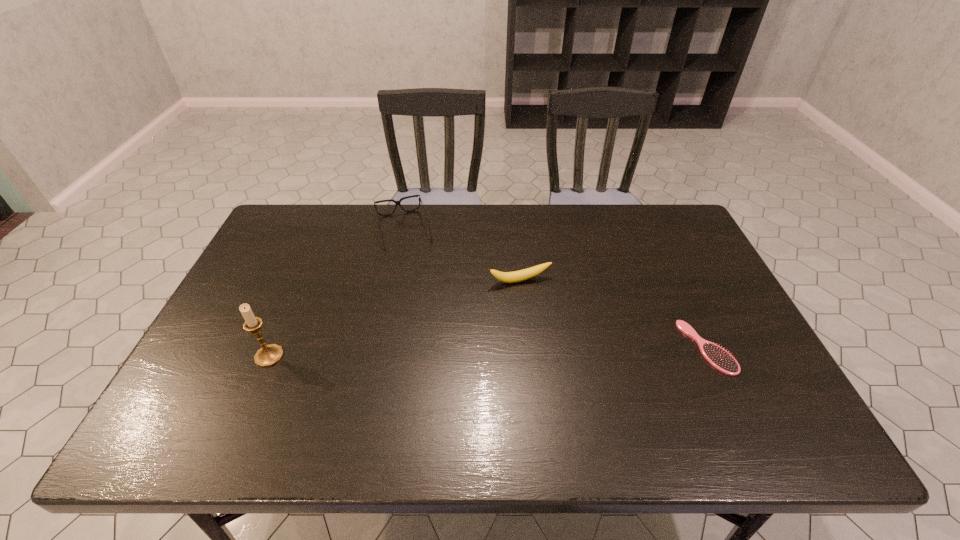
This screenshot has height=540, width=960. In order to click on vacant space that is in between the second object from right to left and the leftmost object in this screenshot , I will do `click(395, 318)`.

Locate an element on the screen. This screenshot has height=540, width=960. empty space that is in between the third object from left to right and the third object from right to left is located at coordinates (462, 255).

Locate an element on the screen. The width and height of the screenshot is (960, 540). free space between the rightmost object and the second farthest object is located at coordinates (613, 314).

You are a GUI agent. You are given a task and a screenshot of the screen. Output one action in this format:
    pyautogui.click(x=<x>, y=<y>)
    Task: Click on the free area in between the hairbrush and the farthest object
    The image size is (960, 540).
    Given the screenshot: What is the action you would take?
    pyautogui.click(x=555, y=288)

What are the coordinates of `vacant area that lies between the leftmost object and the banana` in the screenshot? It's located at (395, 318).

The width and height of the screenshot is (960, 540). Find the location of `free space between the third object from left to right and the rightmost object`. free space between the third object from left to right and the rightmost object is located at coordinates (613, 314).

Locate an element on the screen. This screenshot has width=960, height=540. empty location between the third object from right to left and the second farthest object is located at coordinates (462, 255).

Find the location of a particular element. the closest object relative to the second object from right to left is located at coordinates (396, 202).

Point out which object is positioned as the third nearest to the farthest object. Please provide its 2D coordinates. Your answer should be formatted as a tuple, i.e. [(x, y)], where the tuple contains the x and y coordinates of a point satisfying the conditions above.

[(718, 357)]

The image size is (960, 540). I want to click on free point that satisfies the following two spatial constraints: 1. on the front side of the shortest object; 2. on the left side of the third object from right to left, so click(378, 347).